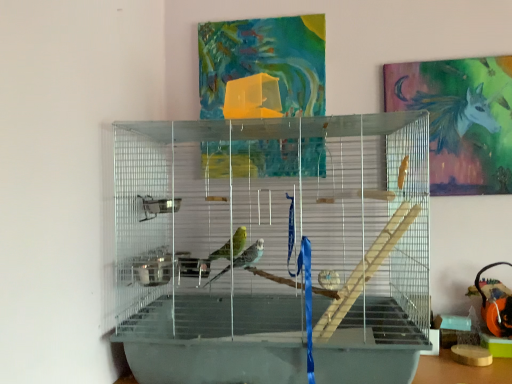
Question: From the image's perspective, would you say metallic unicorn at upper right is positioned over clear plastic birdcage at center?

Choices:
 (A) yes
 (B) no

Answer: (A)

Question: Does metallic unicorn at upper right have a lesser height compared to clear plastic birdcage at center?

Choices:
 (A) yes
 (B) no

Answer: (A)

Question: Is metallic unicorn at upper right aimed at clear plastic birdcage at center?

Choices:
 (A) yes
 (B) no

Answer: (B)

Question: Is clear plastic birdcage at center surrounded by metallic unicorn at upper right?

Choices:
 (A) no
 (B) yes

Answer: (A)

Question: Is metallic unicorn at upper right closer to camera compared to clear plastic birdcage at center?

Choices:
 (A) yes
 (B) no

Answer: (B)

Question: Can you confirm if metallic unicorn at upper right is thinner than clear plastic birdcage at center?

Choices:
 (A) no
 (B) yes

Answer: (B)

Question: Is clear plastic birdcage at center thinner than metallic unicorn at upper right?

Choices:
 (A) no
 (B) yes

Answer: (A)

Question: Can you confirm if clear plastic birdcage at center is shorter than metallic unicorn at upper right?

Choices:
 (A) yes
 (B) no

Answer: (B)

Question: Can you confirm if clear plastic birdcage at center is wider than metallic unicorn at upper right?

Choices:
 (A) yes
 (B) no

Answer: (A)

Question: Is clear plastic birdcage at center bigger than metallic unicorn at upper right?

Choices:
 (A) no
 (B) yes

Answer: (B)

Question: Is clear plastic birdcage at center smaller than metallic unicorn at upper right?

Choices:
 (A) no
 (B) yes

Answer: (A)

Question: Is clear plastic birdcage at center further to camera compared to metallic unicorn at upper right?

Choices:
 (A) no
 (B) yes

Answer: (A)

Question: Relative to clear plastic birdcage at center, is metallic unicorn at upper right in front or behind?

Choices:
 (A) front
 (B) behind

Answer: (B)